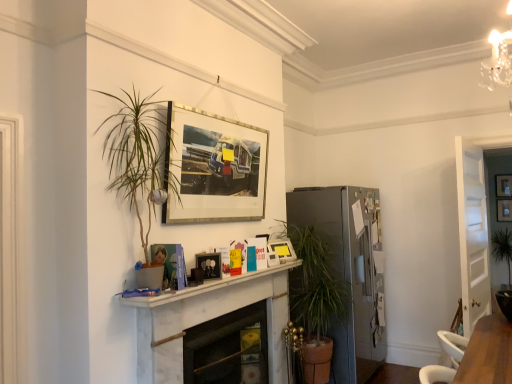
Describe the element at coordinates (208, 320) in the screenshot. I see `white marble fireplace at center, which ranks as the second fireplace in back-to-front order` at that location.

What is the approximate width of wooden picture frame at upper center, the 1th picture frame viewed from the right?

It is 3.01 inches.

Image resolution: width=512 pixels, height=384 pixels. What are the coordinates of `white marble fireplace at center, positioned as the second fireplace in front-to-back order` in the screenshot? It's located at (228, 348).

Describe the element at coordinates (453, 345) in the screenshot. The width and height of the screenshot is (512, 384). I see `white plastic swivel chair at lower right` at that location.

The width and height of the screenshot is (512, 384). What are the coordinates of `matte black picture frame at center, placed as the 1th picture frame when sorted from left to right` in the screenshot? It's located at (209, 264).

Image resolution: width=512 pixels, height=384 pixels. I want to click on white wooden door at right, so click(472, 233).

Does white plastic swivel chair at lower right have a greater width compared to white marble fireplace at center, which ranks as the second fireplace in back-to-front order?

Indeed, white plastic swivel chair at lower right has a greater width compared to white marble fireplace at center, which ranks as the second fireplace in back-to-front order.

Consider the image. From the image's perspective, is white plastic swivel chair at lower right located beneath white marble fireplace at center, arranged as the first fireplace when viewed from the front?

No, from the image's perspective, white plastic swivel chair at lower right is not beneath white marble fireplace at center, arranged as the first fireplace when viewed from the front.

Measure the distance from white plastic swivel chair at lower right to white marble fireplace at center, which ranks as the second fireplace in back-to-front order.

white plastic swivel chair at lower right and white marble fireplace at center, which ranks as the second fireplace in back-to-front order, are 4.82 feet apart.

Is satin silver refrigerator at center-right spatially inside white marble mantle at center, or outside of it?

satin silver refrigerator at center-right is outside white marble mantle at center.

Is satin silver refrigerator at center-right further to camera compared to white marble mantle at center?

Yes, it is behind white marble mantle at center.

From a real-world perspective, is satin silver refrigerator at center-right beneath white marble mantle at center?

Yes, from a real-world perspective, satin silver refrigerator at center-right is under white marble mantle at center.

Is satin silver refrigerator at center-right positioned with its back to matte silver picture frame at upper center, the second picture frame positioned from the right?

satin silver refrigerator at center-right is not turned away from matte silver picture frame at upper center, the second picture frame positioned from the right.

This screenshot has height=384, width=512. What are the coordinates of `the 2nd picture frame behind the satin silver refrigerator at center-right, starting your count from the anchor` in the screenshot? It's located at (504, 185).

Between satin silver refrigerator at center-right and matte silver picture frame at upper center, the second picture frame positioned from the right, which one is positioned behind?

matte silver picture frame at upper center, the second picture frame positioned from the right, is behind.

Does satin silver refrigerator at center-right have a greater height compared to matte silver picture frame at upper center, the 1th picture frame positioned from the back?

Yes.

Is point (343, 381) behind point (461, 350)?

Yes, point (343, 381) is farther from viewer.

From a real-world perspective, between satin silver refrigerator at center-right and white plastic swivel chair at lower right, who is vertically higher?

satin silver refrigerator at center-right is physically above.

Is satin silver refrigerator at center-right directly adjacent to white plastic swivel chair at lower right?

No, satin silver refrigerator at center-right is not touching white plastic swivel chair at lower right.

Can you confirm if satin silver refrigerator at center-right is shorter than white plastic swivel chair at lower right?

No, satin silver refrigerator at center-right is not shorter than white plastic swivel chair at lower right.

Does white marble fireplace at center, arranged as the first fireplace when viewed from the front, turn towards matte silver picture frame at upper center, the 1th picture frame positioned from the back?

No, white marble fireplace at center, arranged as the first fireplace when viewed from the front, is not facing towards matte silver picture frame at upper center, the 1th picture frame positioned from the back.

From the image's perspective, which is above, white marble fireplace at center, arranged as the first fireplace when viewed from the front, or matte silver picture frame at upper center, placed as the 4th picture frame when sorted from left to right?

matte silver picture frame at upper center, placed as the 4th picture frame when sorted from left to right, from the image's perspective.

Consider the image. Is white marble fireplace at center, arranged as the first fireplace when viewed from the front, beside matte silver picture frame at upper center, placed as the 4th picture frame when sorted from left to right?

No, white marble fireplace at center, arranged as the first fireplace when viewed from the front, is not next to matte silver picture frame at upper center, placed as the 4th picture frame when sorted from left to right.

In terms of width, does white marble fireplace at center, arranged as the first fireplace when viewed from the front, look wider or thinner when compared to matte silver picture frame at upper center, placed as the 4th picture frame when sorted from left to right?

white marble fireplace at center, arranged as the first fireplace when viewed from the front, is wider than matte silver picture frame at upper center, placed as the 4th picture frame when sorted from left to right.

Where is `picture frame that is the 3rd object located above the green leafy plant at center (from the image's perspective)`? Image resolution: width=512 pixels, height=384 pixels. picture frame that is the 3rd object located above the green leafy plant at center (from the image's perspective) is located at coordinates (504, 210).

Is wooden picture frame at upper center, the 1th picture frame viewed from the right, further to camera compared to green leafy plant at center?

Yes, wooden picture frame at upper center, the 1th picture frame viewed from the right, is further from the camera.

Is wooden picture frame at upper center, the 2th picture frame from the back, positioned far away from green leafy plant at center?

No, wooden picture frame at upper center, the 2th picture frame from the back, is not far from green leafy plant at center.

Is green leafy plant at center at the back of wooden picture frame at upper center, which is the fourth picture frame from front to back?

wooden picture frame at upper center, which is the fourth picture frame from front to back, is not turned away from green leafy plant at center.

Considering the sizes of objects matte plastic picture frame at center, the third picture frame viewed from the left, and white wooden door at right in the image provided, who is smaller, matte plastic picture frame at center, the third picture frame viewed from the left, or white wooden door at right?

matte plastic picture frame at center, the third picture frame viewed from the left, is smaller.

From the image's perspective, is matte plastic picture frame at center, the 3th picture frame positioned from the right, positioned above or below white wooden door at right?

From the image's perspective, matte plastic picture frame at center, the 3th picture frame positioned from the right, appears below white wooden door at right.

Is matte plastic picture frame at center, placed as the 3th picture frame when sorted from back to front, positioned with its back to white wooden door at right?

No, matte plastic picture frame at center, placed as the 3th picture frame when sorted from back to front, is not facing the opposite direction of white wooden door at right.

Which of these two, matte plastic picture frame at center, placed as the 3th picture frame when sorted from back to front, or white wooden door at right, is thinner?

Thinner between the two is matte plastic picture frame at center, placed as the 3th picture frame when sorted from back to front.

Where is `swivel chair in front of the white marble fireplace at center, which ranks as the second fireplace in back-to-front order`? The image size is (512, 384). swivel chair in front of the white marble fireplace at center, which ranks as the second fireplace in back-to-front order is located at coordinates (453, 345).

Image resolution: width=512 pixels, height=384 pixels. I want to click on fridge on the right of white marble mantle at center, so click(x=348, y=270).

From the image, which object appears to be farther from matte silver picture frame at upper center, the 1th picture frame positioned from the back, white wooden door at right or satin silver refrigerator at center-right?

satin silver refrigerator at center-right.

From the image, which object appears to be farther from white marble mantle at center, silver metallic picture frame at upper center, the 2th picture frame in the left-to-right sequence, or matte plastic picture frame at center, placed as the 3th picture frame when sorted from back to front?

silver metallic picture frame at upper center, the 2th picture frame in the left-to-right sequence, is positioned further to the anchor white marble mantle at center.

Looking at the image, which one is located closer to silver metallic picture frame at upper center, the fifth picture frame in the back-to-front sequence, matte silver picture frame at upper center, placed as the 4th picture frame when sorted from left to right, or matte black picture frame at center, acting as the 2th picture frame starting from the front?

matte black picture frame at center, acting as the 2th picture frame starting from the front.

Looking at the image, which one is located further to white marble fireplace at center, arranged as the first fireplace when viewed from the back, white marble fireplace at center, which ranks as the second fireplace in back-to-front order, or white plastic swivel chair at lower right?

Among the two, white plastic swivel chair at lower right is located further to white marble fireplace at center, arranged as the first fireplace when viewed from the back.

Consider the image. Looking at the image, which one is located further to satin silver refrigerator at center-right, matte silver picture frame at upper center, the 1th picture frame positioned from the back, or white plastic swivel chair at lower right?

matte silver picture frame at upper center, the 1th picture frame positioned from the back, is positioned further to the anchor satin silver refrigerator at center-right.

Looking at the image, which one is located closer to matte plastic picture frame at center, the third picture frame viewed from the front, green leafy plant at center or white plastic swivel chair at lower right?

Among the two, white plastic swivel chair at lower right is located nearer to matte plastic picture frame at center, the third picture frame viewed from the front.

Looking at this image, based on their spatial positions, is matte plastic picture frame at center, the 3th picture frame positioned from the right, or matte silver picture frame at upper center, the second picture frame positioned from the right, further from matte black picture frame at center, placed as the 1th picture frame when sorted from left to right?

matte silver picture frame at upper center, the second picture frame positioned from the right, is further to matte black picture frame at center, placed as the 1th picture frame when sorted from left to right.

From the image, which object appears to be farther from white marble fireplace at center, positioned as the second fireplace in front-to-back order, satin silver refrigerator at center-right or green leafy plant at center?

green leafy plant at center is positioned further to the anchor white marble fireplace at center, positioned as the second fireplace in front-to-back order.

Where is `fridge positioned between silver metallic picture frame at upper center, the fifth picture frame in the back-to-front sequence, and matte silver picture frame at upper center, the 1th picture frame positioned from the back, from near to far`? The width and height of the screenshot is (512, 384). fridge positioned between silver metallic picture frame at upper center, the fifth picture frame in the back-to-front sequence, and matte silver picture frame at upper center, the 1th picture frame positioned from the back, from near to far is located at coordinates (348, 270).

The width and height of the screenshot is (512, 384). Identify the location of fireplace between white marble mantle at center and white marble fireplace at center, positioned as the second fireplace in front-to-back order, in the up-down direction. [x=208, y=320].

Image resolution: width=512 pixels, height=384 pixels. I want to click on fridge between white marble fireplace at center, arranged as the first fireplace when viewed from the back, and wooden picture frame at upper center, which is the 5th picture frame in left-to-right order, in the front-back direction, so click(348, 270).

What are the coordinates of `fireplace located between silver metallic picture frame at upper center, which appears as the fourth picture frame when viewed from the right, and wooden picture frame at upper center, which is the 5th picture frame in left-to-right order, in the depth direction` in the screenshot? It's located at (228, 348).